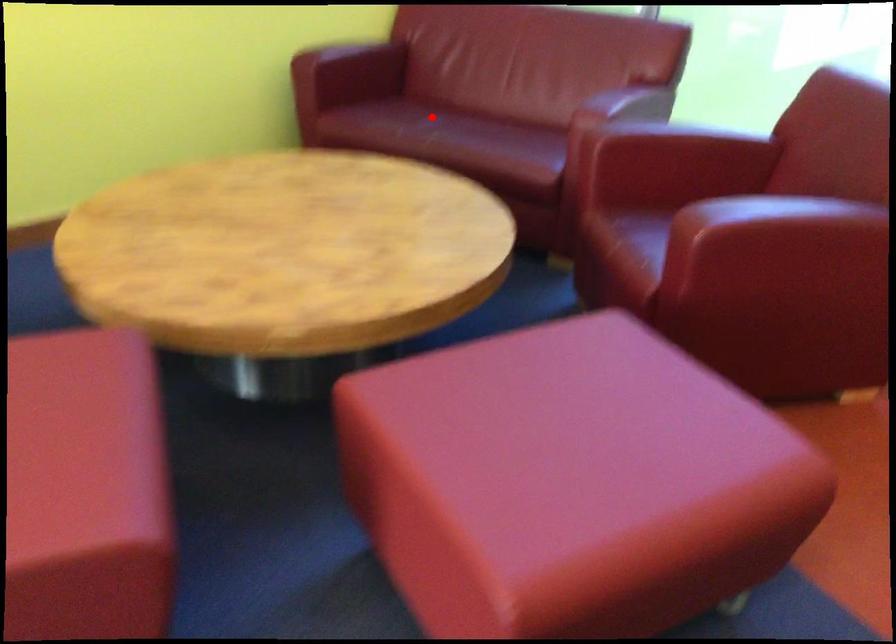
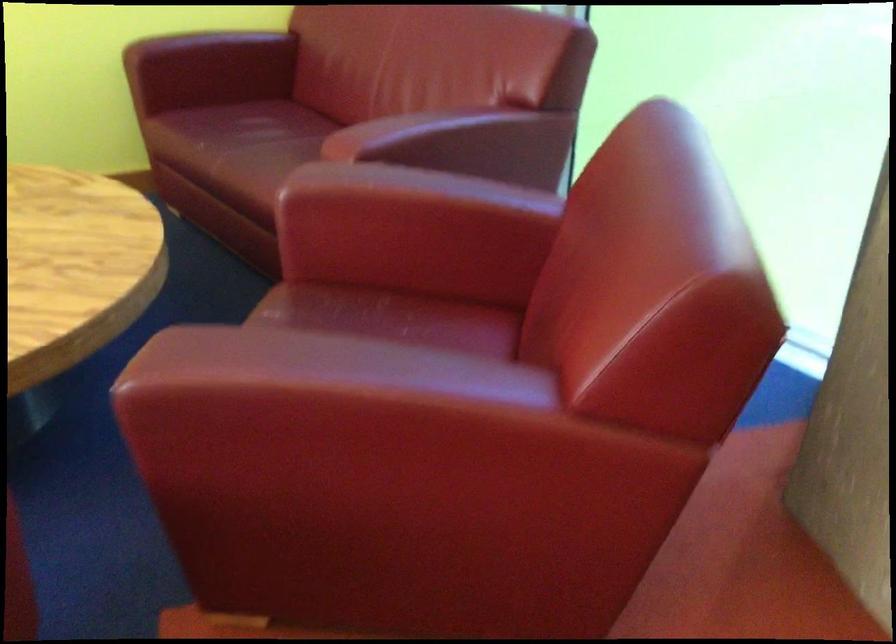
Question: I am providing you with two images of the same scene from different viewpoints. A red point is shown in image1. For the corresponding object point in image2, is it positioned nearer or farther from the camera?

Choices:
 (A) Nearer
 (B) Farther

Answer: (A)